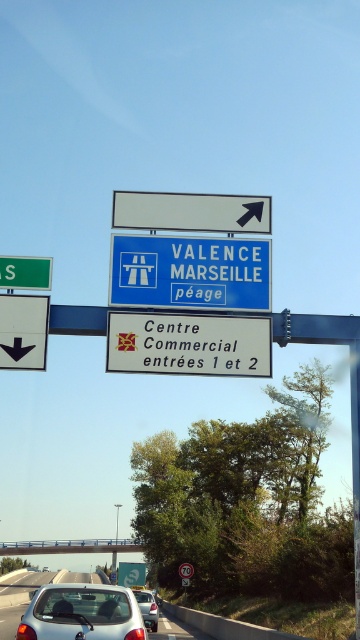
Between point (248, 275) and point (149, 614), which one is positioned in front?

Point (248, 275)

Is point (218, 260) positioned in front of point (144, 605)?

Yes, point (218, 260) is in front of point (144, 605).

Measure the distance between blue plastic sign at upper center and camera.

A distance of 11.76 meters exists between blue plastic sign at upper center and camera.

You are a GUI agent. You are given a task and a screenshot of the screen. Output one action in this format:
    pyautogui.click(x=<x>, y=<y>)
    Task: Click on the blue plastic sign at upper center
    Image resolution: width=360 pixels, height=640 pixels.
    Given the screenshot: What is the action you would take?
    pyautogui.click(x=191, y=273)

Which is below, white paper sign at center or white glossy car at lower center?

white glossy car at lower center is below.

Which is in front, point (263, 346) or point (168, 630)?

Point (263, 346)

Identify the location of white paper sign at center. The width and height of the screenshot is (360, 640). (189, 342).

Who is more distant from viewer, (56, 630) or (154, 602)?

The point (154, 602) is more distant.

Is semi-glossy silver car at center wider than silver metallic car at center?

Yes.

Which is in front, point (50, 608) or point (142, 605)?

Positioned in front is point (50, 608).

You are a GUI agent. You are given a task and a screenshot of the screen. Output one action in this format:
    pyautogui.click(x=<x>, y=<y>)
    Task: Click on the semi-glossy silver car at center
    The image size is (360, 640).
    Given the screenshot: What is the action you would take?
    pyautogui.click(x=82, y=612)